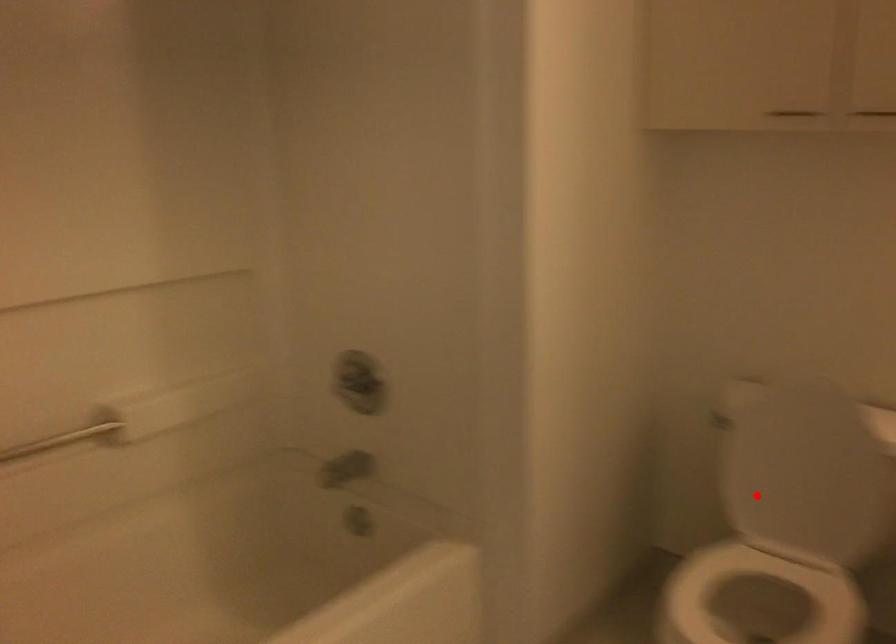
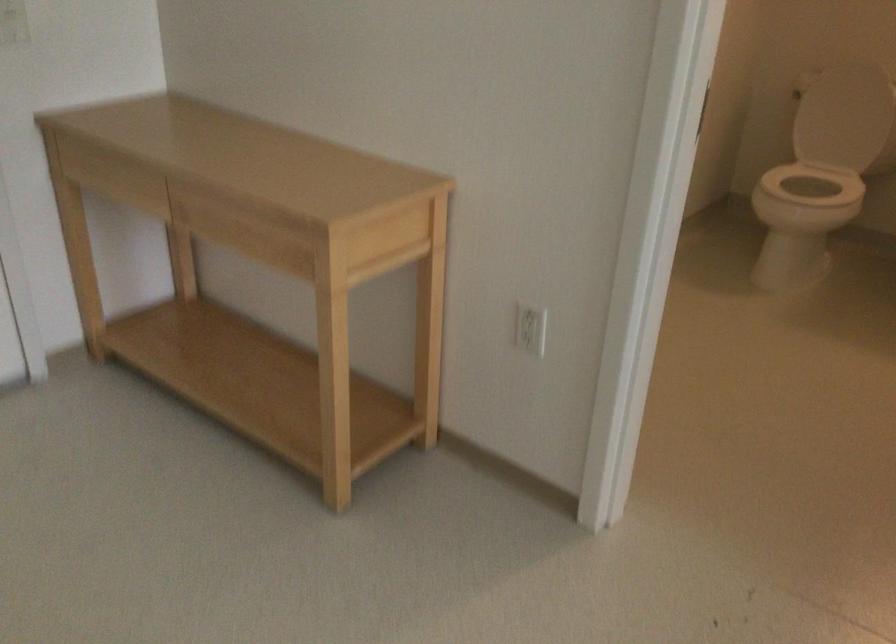
Question: I am providing you with two images of the same scene from different viewpoints. In image1, a red point is highlighted. Considering the same 3D point in image2, which of the following is correct?

Choices:
 (A) It is closer
 (B) It is farther

Answer: (B)